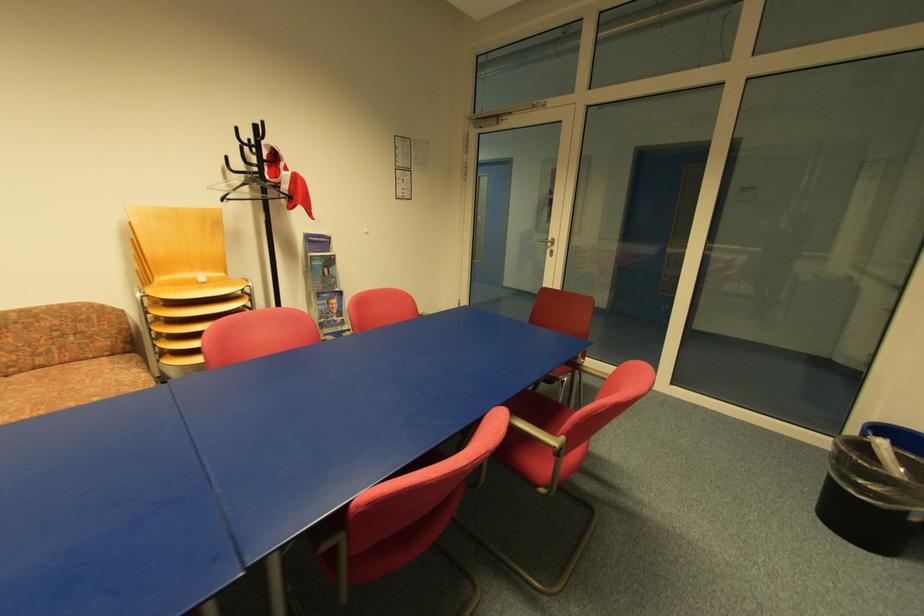
Describe the element at coordinates (70, 384) in the screenshot. The image size is (924, 616). I see `the patterned sofa surface` at that location.